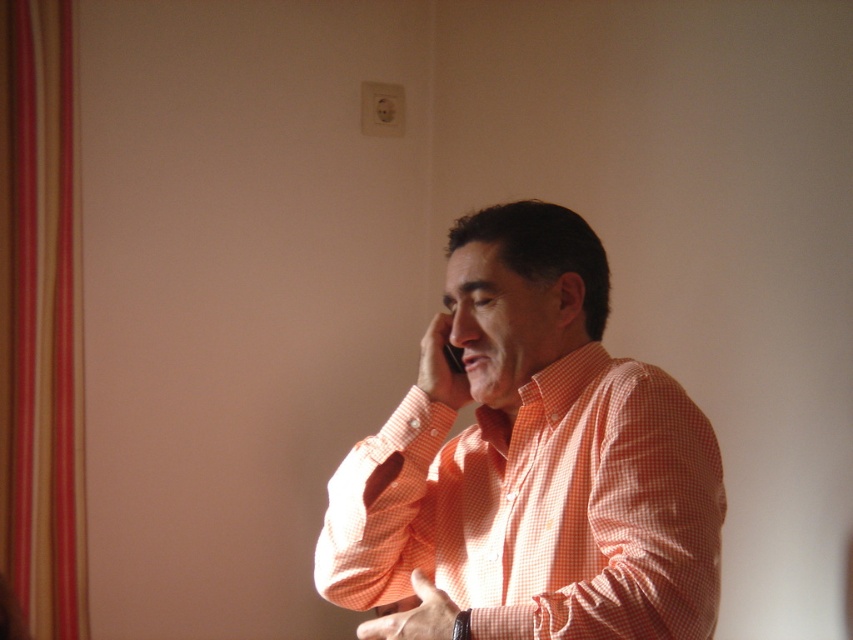
You are a photographer trying to capture the man in the image. If you want to focus on the orange checkered shirt at center, where should you aim your camera? Please provide coordinates in the format of x,y between 0 and 1.

The orange checkered shirt at center is located at coordinates (529, 464), so you should aim your camera at that point to focus on it.

You are a delivery person who needs to deliver a package to a man standing at point (706, 472). The camera is mounted 6 feet above the ground. Can you estimate how far you need to walk from the camera to reach him?

The point (706, 472) is 37.75 inches away from the camera, so you need to walk approximately 37.75 inches from the camera to reach him.